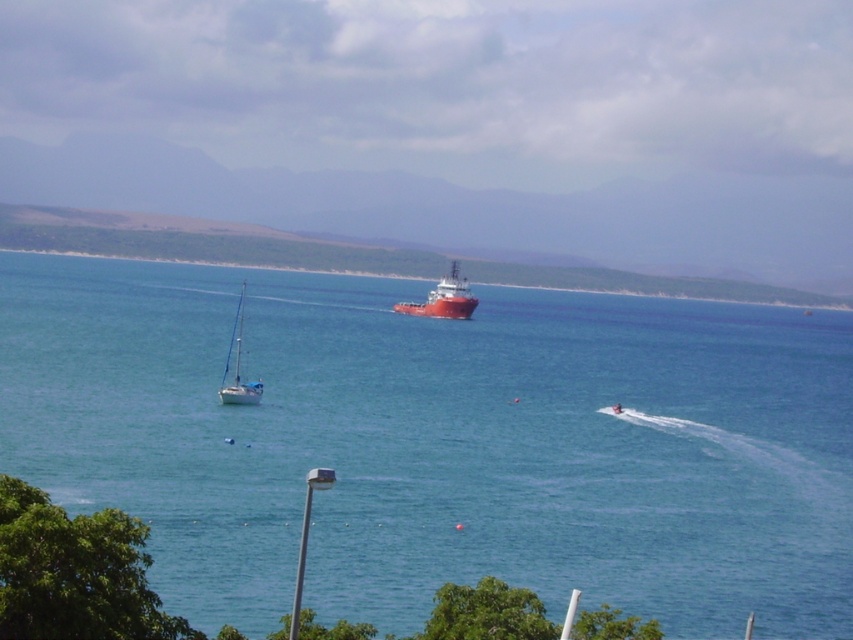
You are a photographer planning to capture the entire scene in one shot. Given that the blue water at center and the red matte ship at center are both in focus, which object will occupy more horizontal space in your photograph?

The blue water at center will occupy more horizontal space in the photograph because its width is larger than that of the red matte ship at center.

You are standing on a cliff overlooking the coast and see the red matte ship at center. If you want to signal to the ship using a flashlight, will the light from your flashlight reach the ship?

The red matte ship at center is 816.13 feet away from viewer. Since the distance is within the effective range of a typical flashlight, the light from your flashlight will likely reach the ship.